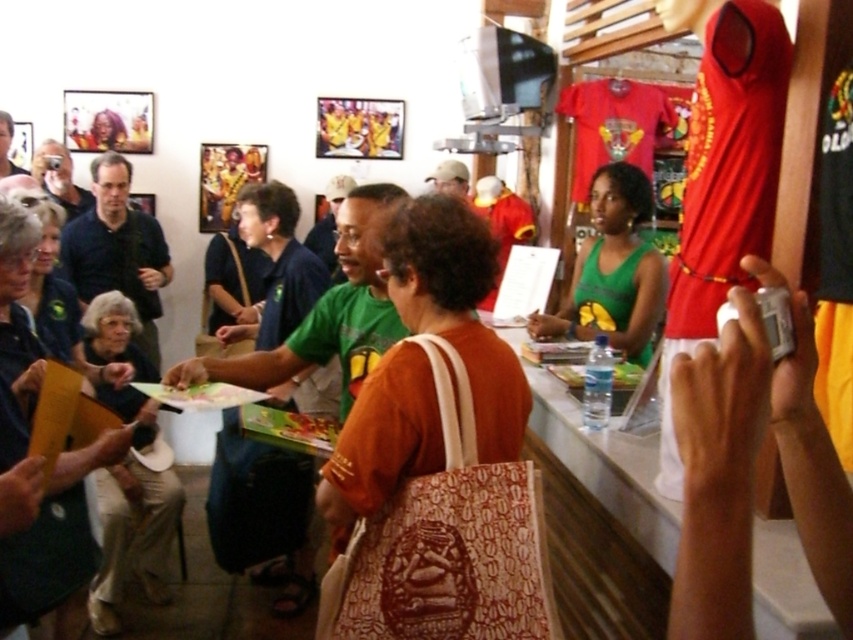
Does brown fabric bag at center appear over green fabric shirt at left?

No, brown fabric bag at center is not above green fabric shirt at left.

Who is more forward, [412,202] or [38,317]?

Point [412,202]

What do you see at coordinates (422, 380) in the screenshot? I see `brown fabric bag at center` at bounding box center [422, 380].

Where is `brown fabric bag at center`? This screenshot has height=640, width=853. brown fabric bag at center is located at coordinates (422, 380).

Between brown fabric bag at center and gray fabric purse at lower left, which one has less height?

brown fabric bag at center

Which is above, brown fabric bag at center or gray fabric purse at lower left?

brown fabric bag at center

At what (x,y) coordinates should I click in order to perform the action: click on brown fabric bag at center. Please return your answer as a coordinate pair (x, y). This screenshot has width=853, height=640. Looking at the image, I should click on (422, 380).

Who is taller, matte black camera at upper left or matte black laptop at upper left?

matte black camera at upper left

Is matte black camera at upper left shorter than matte black laptop at upper left?

Incorrect, matte black camera at upper left's height does not fall short of matte black laptop at upper left's.

Measure the distance between matte black camera at upper left and camera.

matte black camera at upper left is 3.85 meters away from camera.

The width and height of the screenshot is (853, 640). I want to click on matte black camera at upper left, so click(x=59, y=177).